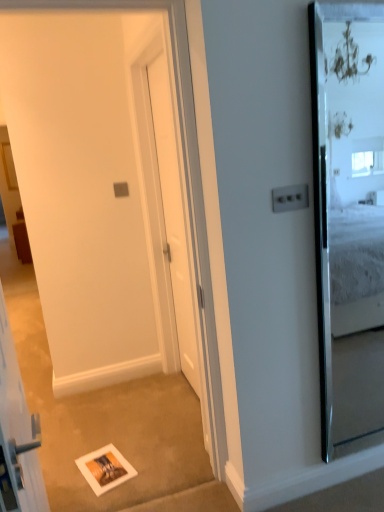
The height and width of the screenshot is (512, 384). Find the location of `vacant region above white glossy picture frame at lower center (from a real-world perspective)`. vacant region above white glossy picture frame at lower center (from a real-world perspective) is located at coordinates (100, 462).